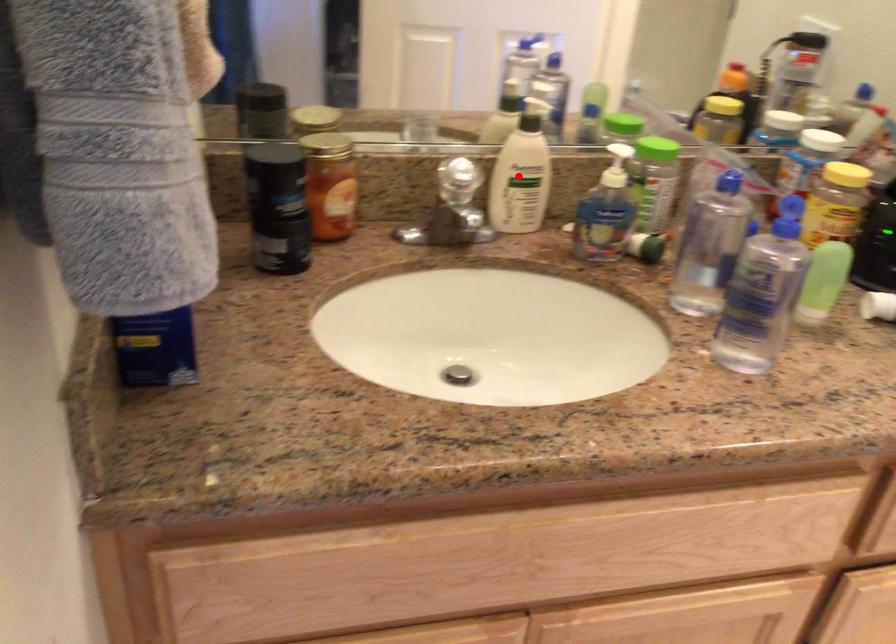
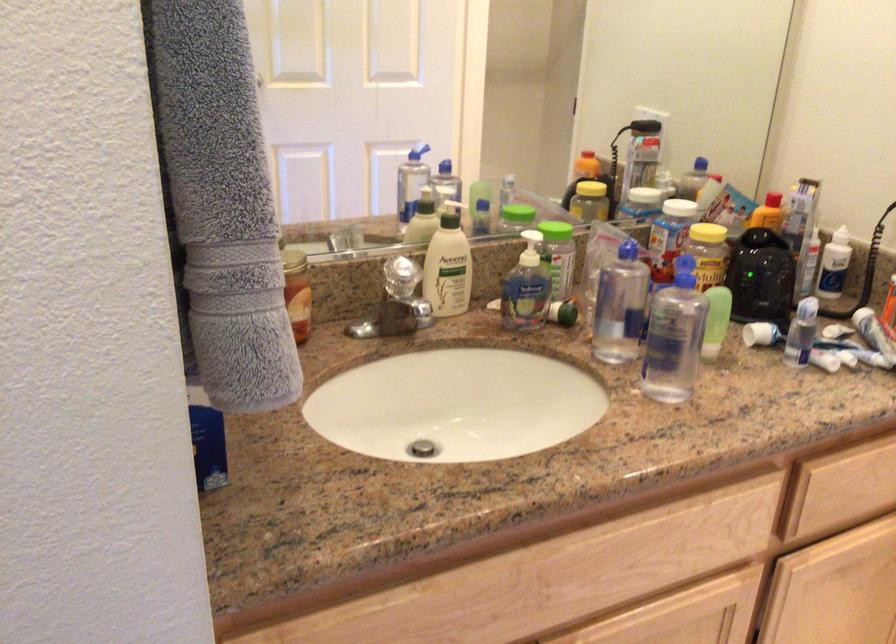
In the second image, find the point that corresponds to the highlighted location in the first image.

(448, 265)